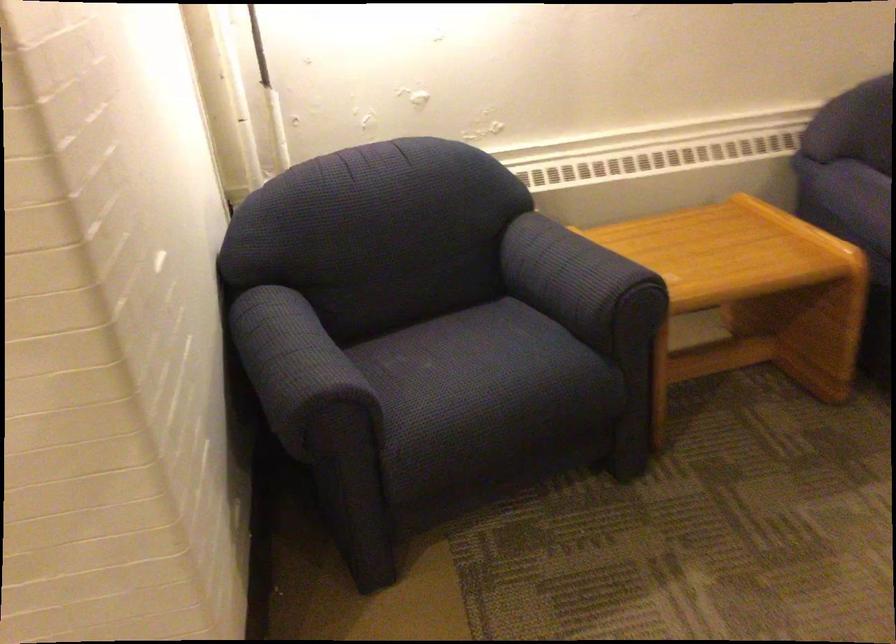
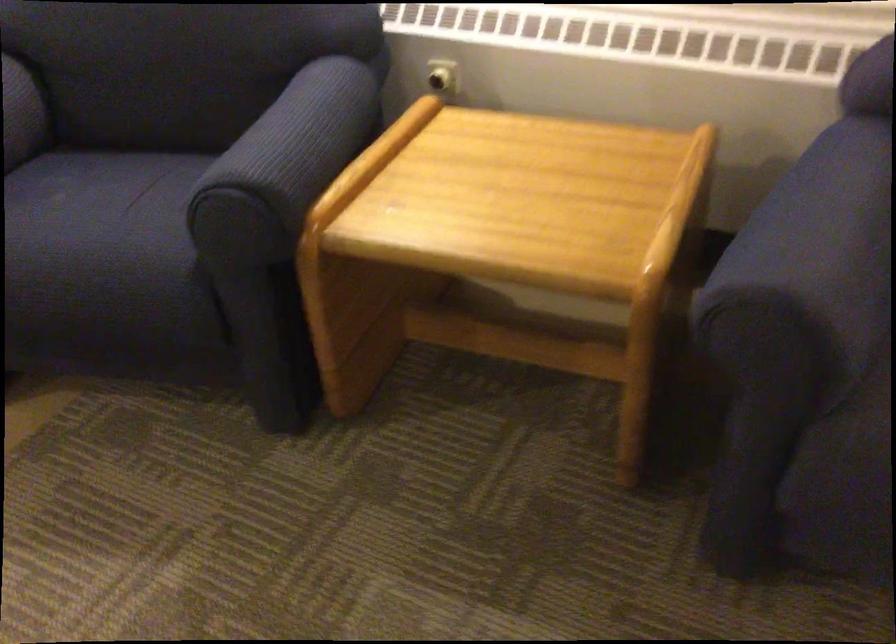
In the second image, find the point that corresponds to [615,251] in the first image.

(295, 144)